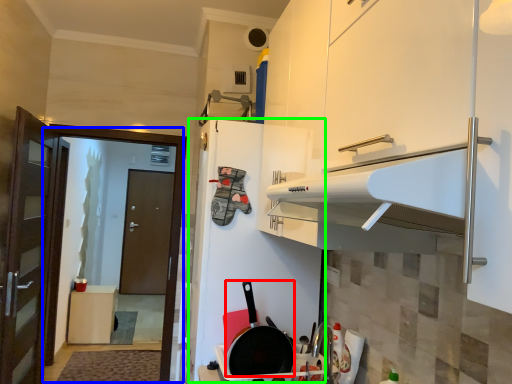
Question: Which is farther away from frying pan (highlighted by a red box)? screen door (highlighted by a blue box) or fridge (highlighted by a green box)?

Choices:
 (A) screen door
 (B) fridge

Answer: (A)